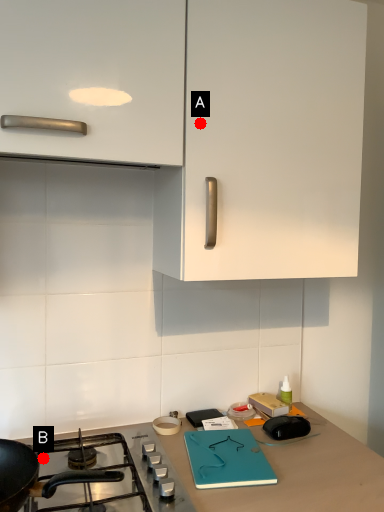
Question: Two points are circled on the image, labeled by A and B beside each circle. Which point is farther from the camera taking this photo?

Choices:
 (A) A is further
 (B) B is further

Answer: (B)